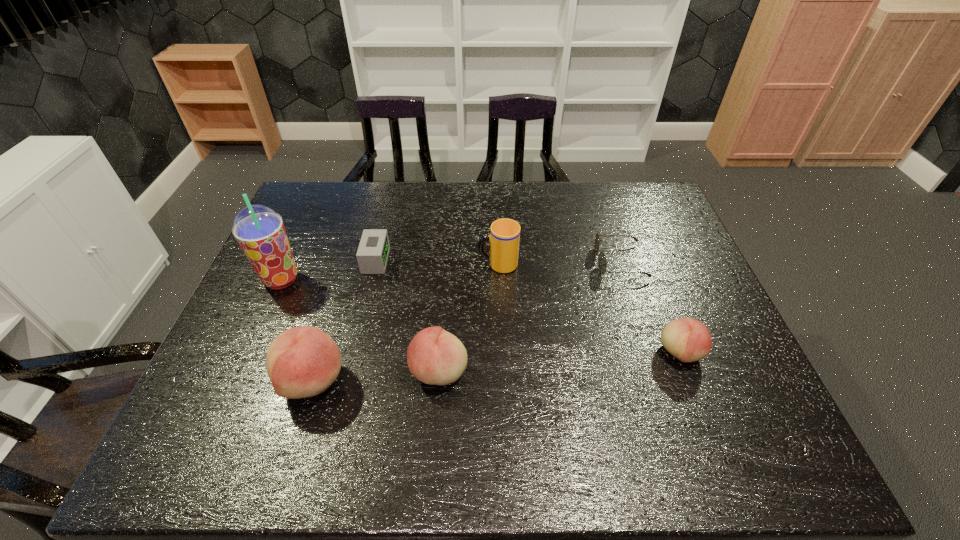
Identify which object is the second nearest to the third shortest object. Please provide its 2D coordinates. Your answer should be formatted as a tuple, i.e. [(x, y)], where the tuple contains the x and y coordinates of a point satisfying the conditions above.

[(504, 238)]

Locate an element on the screen. The image size is (960, 540). object that can be found as the second closest to the fifth tallest object is located at coordinates (504, 238).

You are a GUI agent. You are given a task and a screenshot of the screen. Output one action in this format:
    pyautogui.click(x=<x>, y=<y>)
    Task: Click on the peach that is the closest to the third object from right to left
    This screenshot has width=960, height=540.
    Given the screenshot: What is the action you would take?
    pyautogui.click(x=436, y=357)

At what (x,y) coordinates should I click in order to perform the action: click on peach that is the third closest one to the leftmost object. Please return your answer as a coordinate pair (x, y). Image resolution: width=960 pixels, height=540 pixels. Looking at the image, I should click on (688, 340).

The image size is (960, 540). In order to click on vacant area in the image that satisfies the following two spatial constraints: 1. on the front-facing side of the alarm clock; 2. on the side of the fifth object from left to right with the handle in this screenshot , I will do `click(374, 265)`.

Locate an element on the screen. Image resolution: width=960 pixels, height=540 pixels. blank space that satisfies the following two spatial constraints: 1. on the front side of the smoothie; 2. on the right side of the second shortest peach is located at coordinates (241, 370).